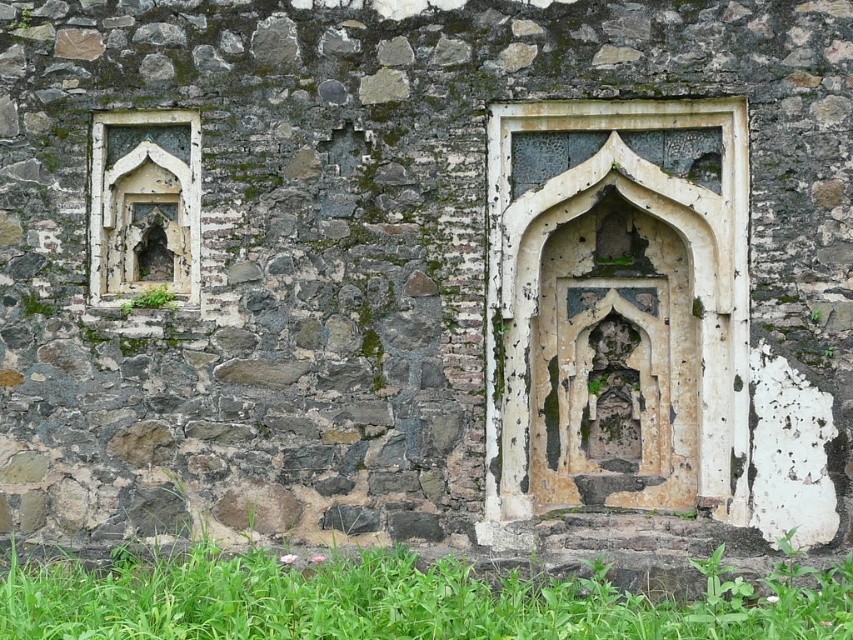
Question: Which of the following is the farthest from the observer?

Choices:
 (A) (621, 445)
 (B) (109, 200)

Answer: (A)

Question: Considering the real-world distances, which object is farthest from the green leafy weed at lower left?

Choices:
 (A) white stone arch at center
 (B) green grass at lower center

Answer: (A)

Question: Does white stone arch at center appear on the right side of stone/rough stone arch at left?

Choices:
 (A) no
 (B) yes

Answer: (B)

Question: Can you confirm if white stone arch at center is bigger than green grass at lower center?

Choices:
 (A) no
 (B) yes

Answer: (A)

Question: Is white stone arch at center to the left of green grass at lower center from the viewer's perspective?

Choices:
 (A) yes
 (B) no

Answer: (B)

Question: Among these points, which one is farthest from the camera?

Choices:
 (A) (160, 285)
 (B) (596, 355)
 (C) (474, 616)

Answer: (B)